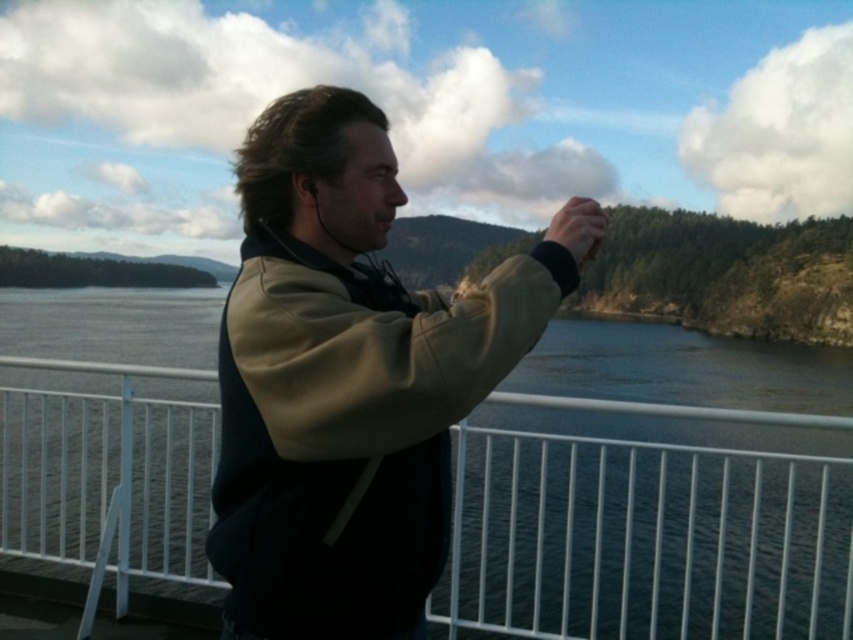
You are a photographer trying to capture the reflection of the forest in the water. You have a white metal rail at center and a khaki fleece jacket at center in your frame. Which object should you move to get a clearer view of the reflection?

The white metal rail at center is positioned on the right side of khaki fleece jacket at center. To get a clearer view of the reflection, you should move the white metal rail at center to the side, as it is blocking the line of sight to the water and forest reflection.

You are a photographer trying to capture the reflection of the forest in the water. The white metal rail at center is blocking your shot. Can you move around it to get a clear view? Explain your reasoning.

The white metal rail at center is located at coordinates (643, 540). Since it is a physical object in the scene, you can move around it to get a clear view of the forest reflection in the water.